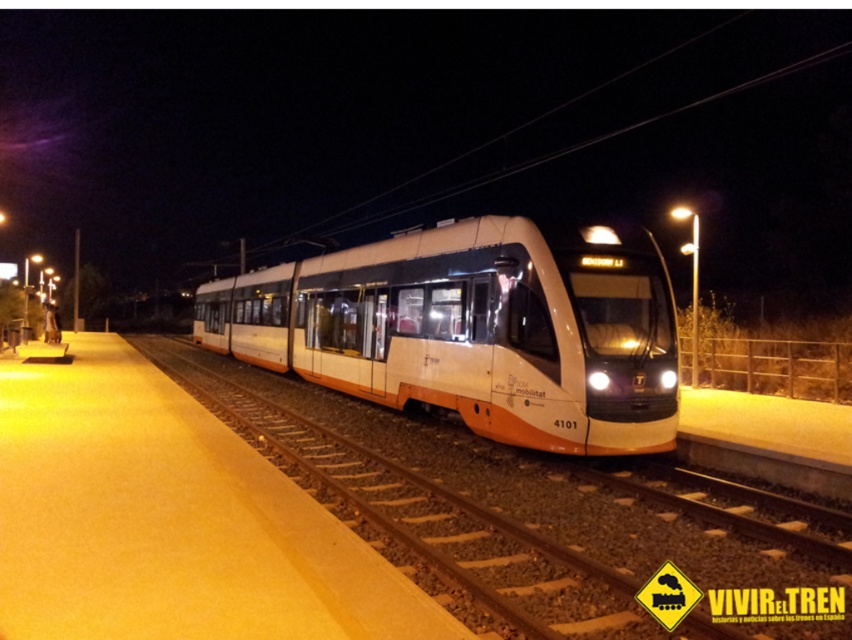
Question: Can you confirm if white metallic track at center is positioned to the right of white glossy train at center?

Choices:
 (A) yes
 (B) no

Answer: (A)

Question: In this image, where is white metallic track at center located relative to white glossy train at center?

Choices:
 (A) above
 (B) below

Answer: (B)

Question: Which object is farther from the camera taking this photo?

Choices:
 (A) white metallic track at center
 (B) white glossy train at center

Answer: (B)

Question: Among these objects, which one is farthest from the camera?

Choices:
 (A) white glossy train at center
 (B) white metallic track at center

Answer: (A)

Question: Is white metallic track at center behind white glossy train at center?

Choices:
 (A) yes
 (B) no

Answer: (B)